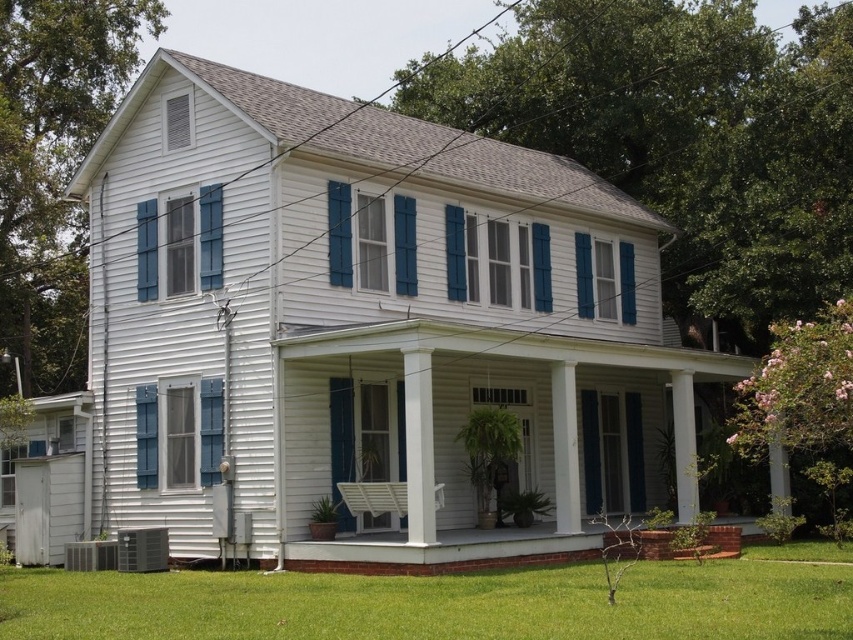
You are standing at the point marked by coordinates point (480, 406). Looking around, you see the white wood porch at center. Which direction should you walk to reach the front entrance of the house?

Since the point (480, 406) is located on the white wood porch at center, you are already standing on the porch. The front entrance is likely directly ahead or to the front of the porch, so you should walk forward towards the house to reach it.

Looking at this image, you are a gardener who needs to mow the lawn. You see the green grass at lower center and the white wood porch at lower center. Which area requires immediate attention based on their current states?

The green grass at lower center requires immediate attention because it is much taller than the white wood porch at lower center, indicating it needs mowing.